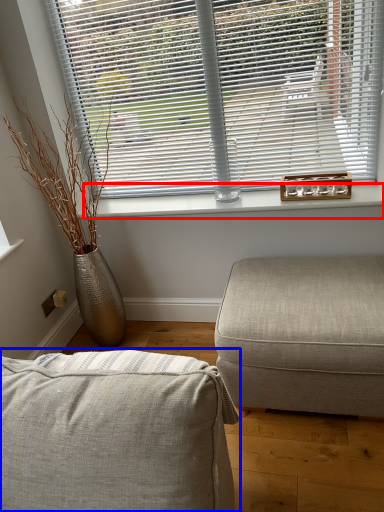
Question: Which of the following is the closest to the observer, window sill (highlighted by a red box) or studio couch (highlighted by a blue box)?

Choices:
 (A) window sill
 (B) studio couch

Answer: (B)